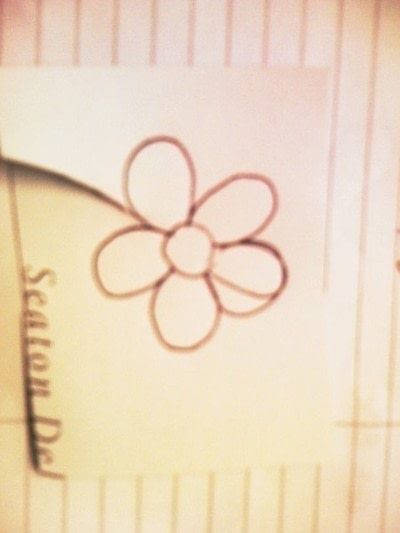
At what (x,y) coordinates should I click in order to perform the action: click on note paper to the right of drawing. Please return your answer as a coordinate pair (x, y). Image resolution: width=400 pixels, height=533 pixels. Looking at the image, I should click on (360, 277).